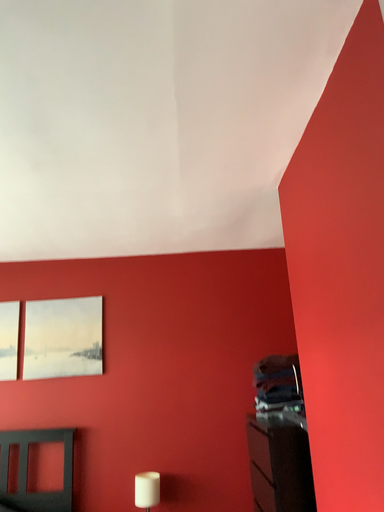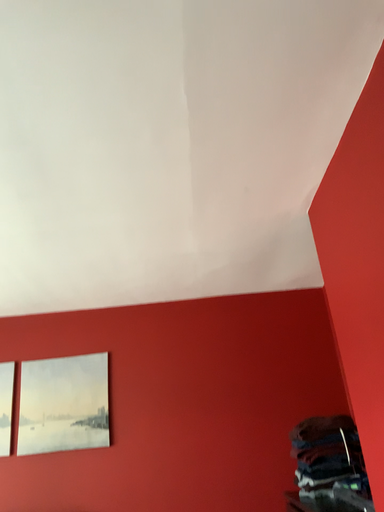
Question: Which way did the camera rotate in the video?

Choices:
 (A) rotated upward
 (B) rotated downward

Answer: (A)